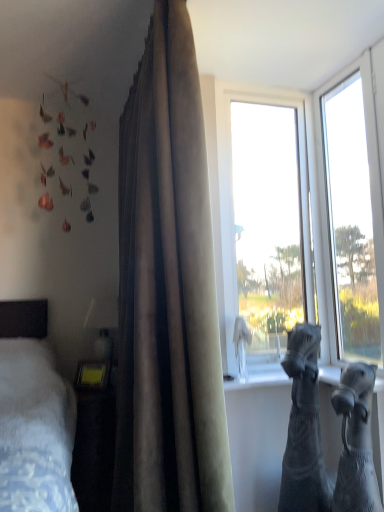
Question: Is black denim jeans at lower right, positioned as the second animal in front-to-back order, outside transparent glass window at upper right, which is counted as the second window, starting from the right?

Choices:
 (A) no
 (B) yes

Answer: (B)

Question: From the image's perspective, is black denim jeans at lower right, the first animal positioned from the back, located above transparent glass window at upper right, positioned as the first window in left-to-right order?

Choices:
 (A) yes
 (B) no

Answer: (B)

Question: Can you confirm if black denim jeans at lower right, the first animal positioned from the back, is bigger than transparent glass window at upper right, which is counted as the second window, starting from the right?

Choices:
 (A) yes
 (B) no

Answer: (B)

Question: From a real-world perspective, is black denim jeans at lower right, positioned as the second animal in front-to-back order, on transparent glass window at upper right, positioned as the first window in left-to-right order?

Choices:
 (A) yes
 (B) no

Answer: (B)

Question: From the image's perspective, would you say black denim jeans at lower right, the first animal positioned from the back, is shown under transparent glass window at upper right, positioned as the first window in left-to-right order?

Choices:
 (A) no
 (B) yes

Answer: (B)

Question: Is black denim jeans at lower right, the first animal positioned from the back, next to transparent glass window at upper right, which is counted as the second window, starting from the right?

Choices:
 (A) no
 (B) yes

Answer: (A)

Question: Considering the relative positions of black denim jeans at lower right, the first animal positioned from the back, and satin-like beige curtain at center in the image provided, is black denim jeans at lower right, the first animal positioned from the back, to the right of satin-like beige curtain at center from the viewer's perspective?

Choices:
 (A) no
 (B) yes

Answer: (B)

Question: Can you confirm if black denim jeans at lower right, the first animal positioned from the back, is taller than satin-like beige curtain at center?

Choices:
 (A) no
 (B) yes

Answer: (A)

Question: Is black denim jeans at lower right, positioned as the second animal in front-to-back order, shorter than satin-like beige curtain at center?

Choices:
 (A) no
 (B) yes

Answer: (B)

Question: Is black denim jeans at lower right, positioned as the second animal in front-to-back order, looking in the opposite direction of satin-like beige curtain at center?

Choices:
 (A) no
 (B) yes

Answer: (A)

Question: From the image's perspective, is black denim jeans at lower right, positioned as the second animal in front-to-back order, above satin-like beige curtain at center?

Choices:
 (A) no
 (B) yes

Answer: (A)

Question: Is black denim jeans at lower right, positioned as the second animal in front-to-back order, positioned before satin-like beige curtain at center?

Choices:
 (A) no
 (B) yes

Answer: (A)

Question: Can satin-like beige curtain at center be found inside black knitted socks at lower right, positioned as the second animal in back-to-front order?

Choices:
 (A) yes
 (B) no

Answer: (B)